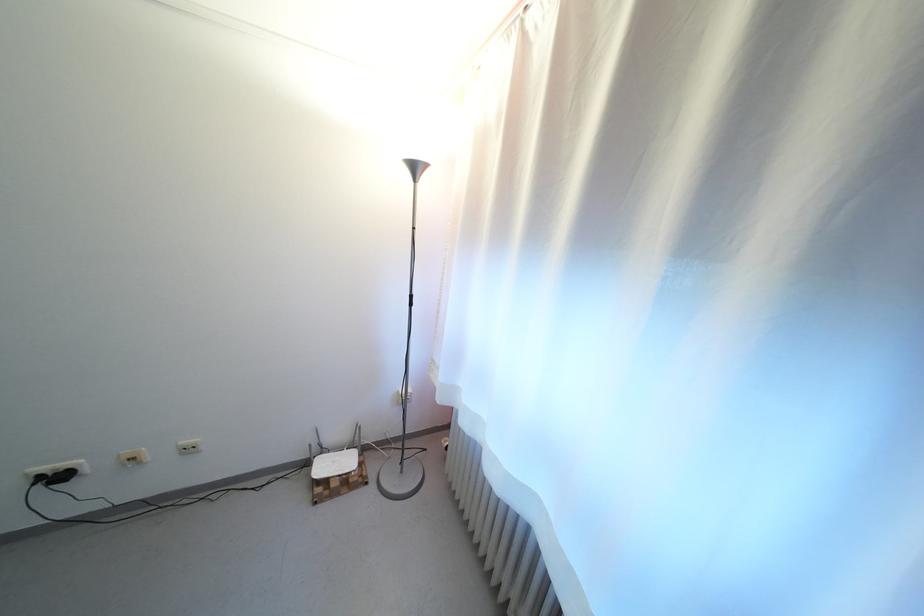
I want to click on white router, so click(x=335, y=460).